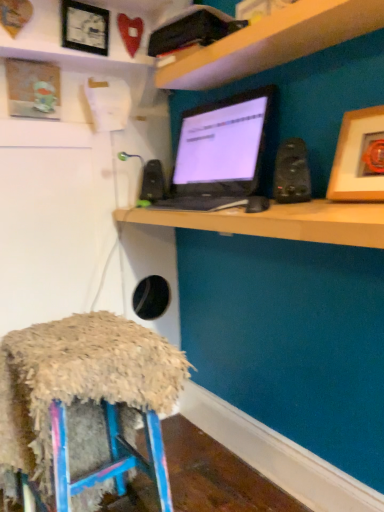
Question: Is wooden picture frame at upper right, which is the first picture frame in bottom-to-top order, at the back of wooden framed picture at upper left, the 3th picture frame when ordered from bottom to top?

Choices:
 (A) yes
 (B) no

Answer: (B)

Question: From the image's perspective, is wooden framed picture at upper left, which is the second picture frame in back-to-front order, located beneath wooden picture frame at upper right, the 3th picture frame in the top-to-bottom sequence?

Choices:
 (A) no
 (B) yes

Answer: (A)

Question: Is wooden framed picture at upper left, which appears as the second picture frame when viewed from the front, closer to the viewer compared to wooden picture frame at upper right, the first picture frame positioned from the front?

Choices:
 (A) no
 (B) yes

Answer: (A)

Question: Considering the relative positions of wooden framed picture at upper left, which is the second picture frame in back-to-front order, and wooden picture frame at upper right, the 1th picture frame in the right-to-left sequence, in the image provided, is wooden framed picture at upper left, which is the second picture frame in back-to-front order, to the right of wooden picture frame at upper right, the 1th picture frame in the right-to-left sequence, from the viewer's perspective?

Choices:
 (A) yes
 (B) no

Answer: (B)

Question: Is wooden framed picture at upper left, which appears as the second picture frame when viewed from the front, taller than wooden picture frame at upper right, the first picture frame positioned from the front?

Choices:
 (A) no
 (B) yes

Answer: (A)

Question: In terms of size, does fuzzy fabric stool at lower left appear bigger or smaller than black glossy monitor at center?

Choices:
 (A) big
 (B) small

Answer: (A)

Question: Considering the positions of point (16, 454) and point (324, 226), is point (16, 454) closer or farther from the camera than point (324, 226)?

Choices:
 (A) closer
 (B) farther

Answer: (B)

Question: From a real-world perspective, is fuzzy fabric stool at lower left above or below black glossy monitor at center?

Choices:
 (A) above
 (B) below

Answer: (B)

Question: Would you say fuzzy fabric stool at lower left is inside or outside black glossy monitor at center?

Choices:
 (A) inside
 (B) outside

Answer: (B)

Question: In the image, is wooden picture frame at upper right, the first picture frame positioned from the front, positioned in front of or behind black matte speaker at center, which appears as the second speaker when viewed from the right?

Choices:
 (A) behind
 (B) front

Answer: (B)

Question: Looking at their shapes, would you say wooden picture frame at upper right, the 3th picture frame in the top-to-bottom sequence, is wider or thinner than black matte speaker at center, which is the second speaker from front to back?

Choices:
 (A) wide
 (B) thin

Answer: (A)

Question: From the image's perspective, is wooden picture frame at upper right, the 3th picture frame in the top-to-bottom sequence, above or below black matte speaker at center, arranged as the first speaker when viewed from the back?

Choices:
 (A) above
 (B) below

Answer: (B)

Question: From a real-world perspective, relative to black matte speaker at center, which appears as the second speaker when viewed from the right, is wooden picture frame at upper right, the third picture frame in the left-to-right sequence, vertically above or below?

Choices:
 (A) above
 (B) below

Answer: (A)

Question: In the image, is black plastic speaker at upper right, marked as the 2th speaker in a left-to-right arrangement, on the left side or the right side of fuzzy fabric stool at lower left?

Choices:
 (A) right
 (B) left

Answer: (A)

Question: Do you think black plastic speaker at upper right, the first speaker positioned from the right, is within fuzzy fabric stool at lower left, or outside of it?

Choices:
 (A) outside
 (B) inside

Answer: (A)